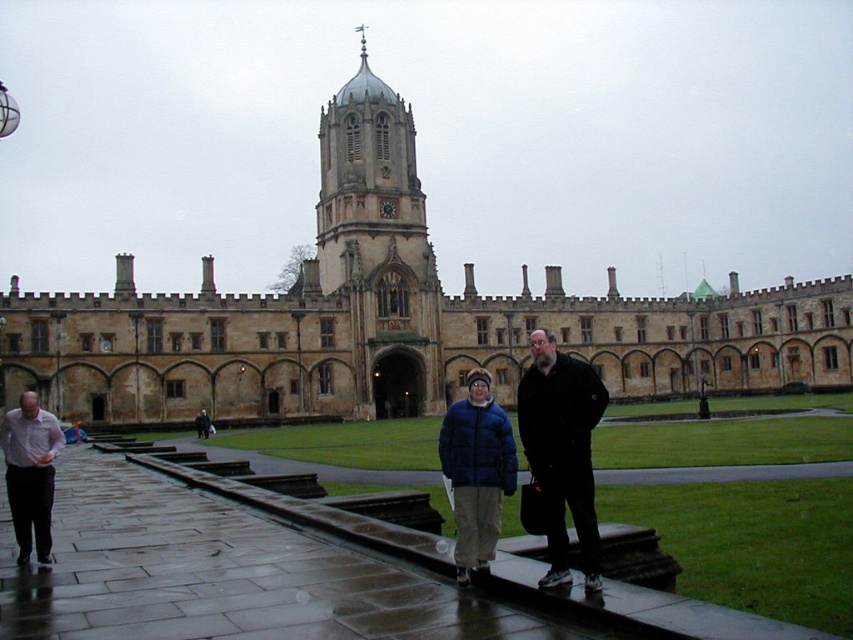
Which of these two, brown stone church at center or black matte jacket at center, stands taller?

With more height is brown stone church at center.

Is brown stone church at center smaller than black matte jacket at center?

No, brown stone church at center is not smaller than black matte jacket at center.

Measure the distance between brown stone church at center and camera.

250.09 feet

At what (x,y) coordinates should I click in order to perform the action: click on brown stone church at center. Please return your answer as a coordinate pair (x, y). Looking at the image, I should click on (393, 316).

Who is positioned more to the left, matte blue puffer jacket at center or matte pink shirt at left?

From the viewer's perspective, matte pink shirt at left appears more on the left side.

Is matte blue puffer jacket at center thinner than matte pink shirt at left?

Yes.

Does point (479, 380) lie behind point (38, 490)?

That is True.

Locate an element on the screen. The height and width of the screenshot is (640, 853). matte blue puffer jacket at center is located at coordinates coord(476,472).

Is point (161, 417) farther from viewer compared to point (488, 449)?

Yes, point (161, 417) is behind point (488, 449).

The height and width of the screenshot is (640, 853). I want to click on brown stone church at center, so click(393, 316).

Is point (381, 371) closer to camera compared to point (457, 493)?

No, it is not.

The height and width of the screenshot is (640, 853). I want to click on brown stone church at center, so click(x=393, y=316).